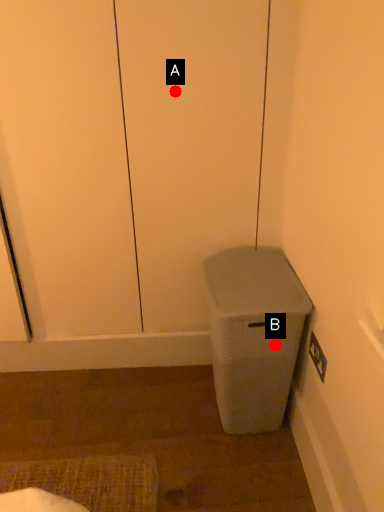
Question: Two points are circled on the image, labeled by A and B beside each circle. Which of the following is the closest to the observer?

Choices:
 (A) A is closer
 (B) B is closer

Answer: (B)